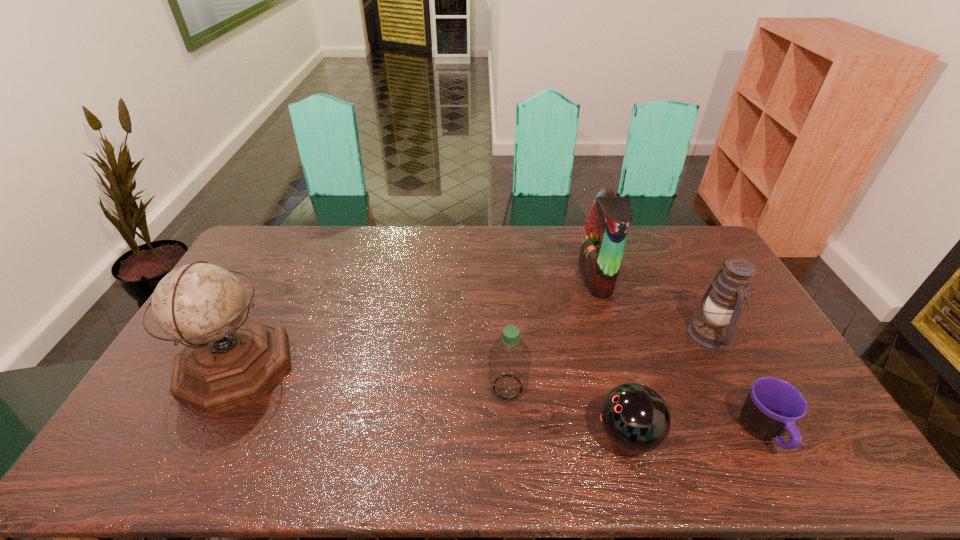
This screenshot has width=960, height=540. I want to click on free space between the bowling ball and the mug, so click(696, 434).

The width and height of the screenshot is (960, 540). Find the location of `blank region between the shortest object and the second shortest object`. blank region between the shortest object and the second shortest object is located at coordinates (696, 434).

I want to click on vacant region between the leftmost object and the farthest object, so click(x=416, y=321).

Locate an element on the screen. The width and height of the screenshot is (960, 540). free point between the second object from left to right and the leftmost object is located at coordinates (x=372, y=376).

The height and width of the screenshot is (540, 960). Identify the location of free spot between the parrot and the water bottle. [552, 332].

I want to click on free spot between the farthest object and the shortest object, so click(x=680, y=355).

Identify the location of blank region between the water bottle and the globe. Image resolution: width=960 pixels, height=540 pixels. (372, 376).

Locate which object ranks in proximity to the shortest object. Please provide its 2D coordinates. Your answer should be formatted as a tuple, i.e. [(x, y)], where the tuple contains the x and y coordinates of a point satisfying the conditions above.

[(722, 304)]

Where is `object that is the nearest to the second shortest object`? This screenshot has width=960, height=540. object that is the nearest to the second shortest object is located at coordinates (509, 360).

The height and width of the screenshot is (540, 960). I want to click on free location that satisfies the following two spatial constraints: 1. on the back side of the water bottle; 2. on the right side of the oil lamp, so click(505, 336).